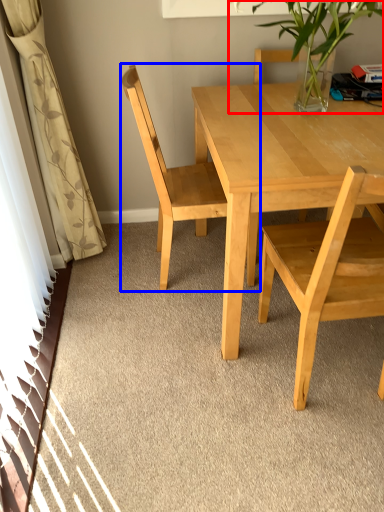
Question: Which point is further to the camera, houseplant (highlighted by a red box) or chair (highlighted by a blue box)?

Choices:
 (A) houseplant
 (B) chair

Answer: (B)